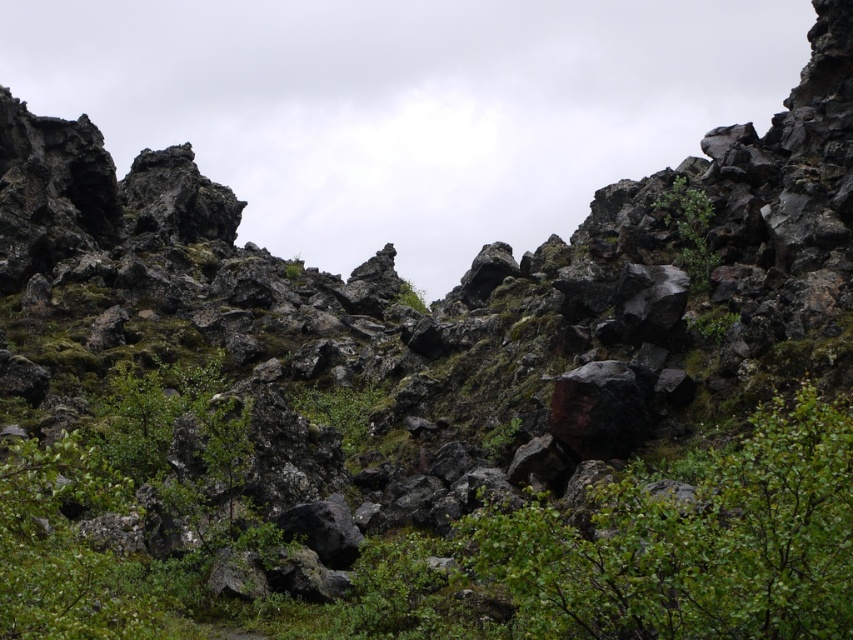
The width and height of the screenshot is (853, 640). I want to click on shiny black rock at center-right, so click(x=650, y=298).

Who is more forward, (630,300) or (689,220)?

Positioned in front is point (630,300).

This screenshot has width=853, height=640. I want to click on shiny black rock at center-right, so click(x=650, y=298).

Is the position of green leafy shrubs at center less distant than that of shiny black rock at center-right?

Yes, it is in front of shiny black rock at center-right.

Find the location of a particular element. The width and height of the screenshot is (853, 640). green leafy shrubs at center is located at coordinates (646, 548).

Locate an element on the screen. Image resolution: width=853 pixels, height=640 pixels. green leafy shrubs at center is located at coordinates (646, 548).

Find the location of `green leafy shrubs at center`. green leafy shrubs at center is located at coordinates (646, 548).

Which is more to the right, green leafy shrubs at center or green leafy shrub at upper right?

green leafy shrub at upper right

Between green leafy shrubs at center and green leafy shrub at upper right, which one has more height?

Standing taller between the two is green leafy shrubs at center.

You are a GUI agent. You are given a task and a screenshot of the screen. Output one action in this format:
    pyautogui.click(x=<x>, y=<y>)
    Task: Click on the green leafy shrubs at center
    This screenshot has width=853, height=640.
    Given the screenshot: What is the action you would take?
    pyautogui.click(x=646, y=548)